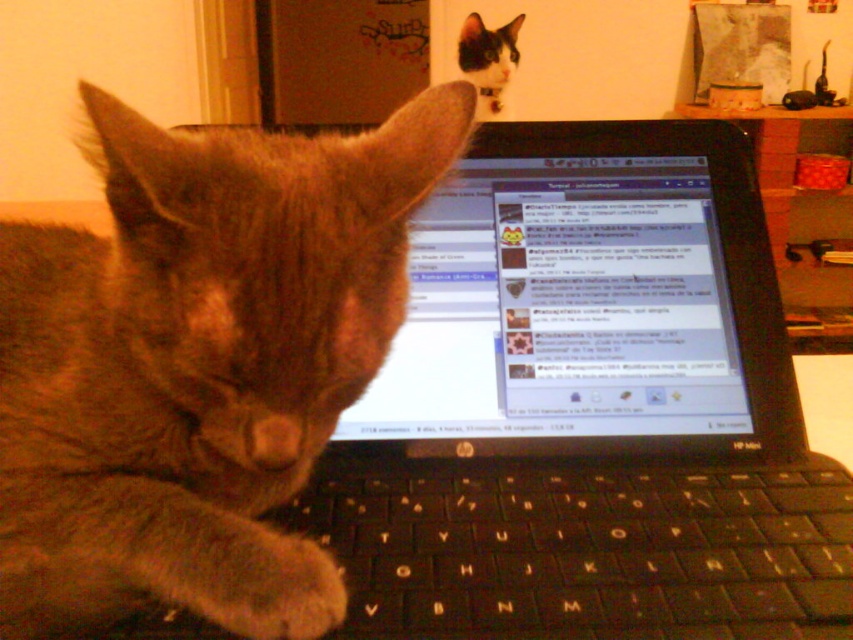
You are a photographer trying to capture both the fuzzy fur paw at keyboard center and the black fur cat at upper center in one frame. Based on their positions, which one is closer to the left edge of the image?

The fuzzy fur paw at keyboard center is to the left of black fur cat at upper center, so it is closer to the left edge of the image.

You are a photographer setting up a shot of the metallic silver can at upper center and the black fur cat at upper center. To ensure both subjects are in focus, you need to know their vertical positions. Which one is higher in the frame?

The metallic silver can at upper center is located above the black fur cat at upper center, so it is higher in the frame.

You are a photographer trying to capture a clear photo of the fuzzy brown cat at center. However, the fuzzy fur paw at keyboard center is blocking the view. Can you estimate if the paw is smaller than the cat in width to determine if moving it might reveal the cat?

The fuzzy brown cat at center is larger in width than the fuzzy fur paw at keyboard center, so moving the paw could potentially reveal more of the cat since the paw is smaller.